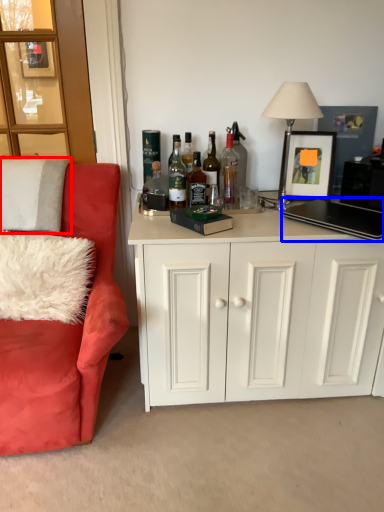
Question: Which of the following is the farthest to the observer, pillow (highlighted by a red box) or laptop (highlighted by a blue box)?

Choices:
 (A) pillow
 (B) laptop

Answer: (A)